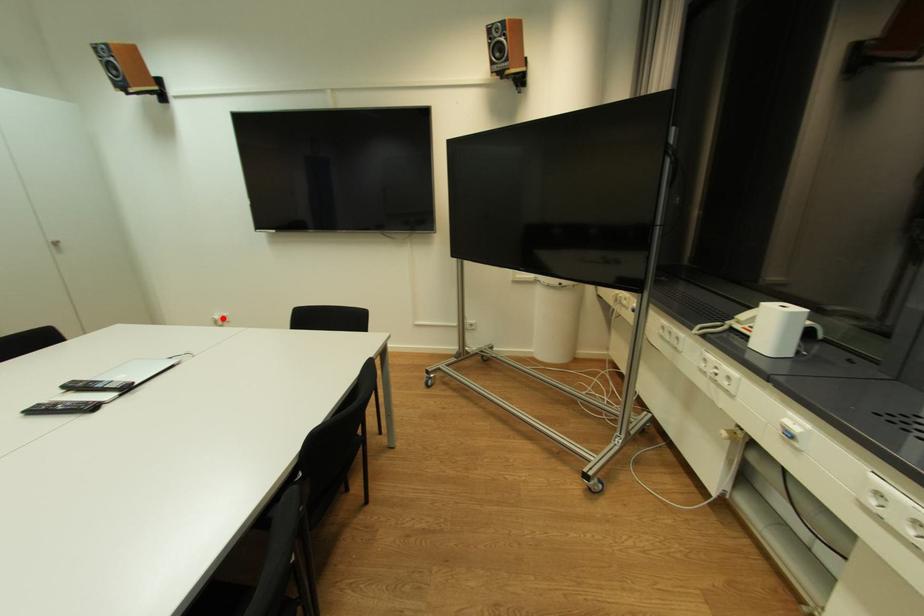
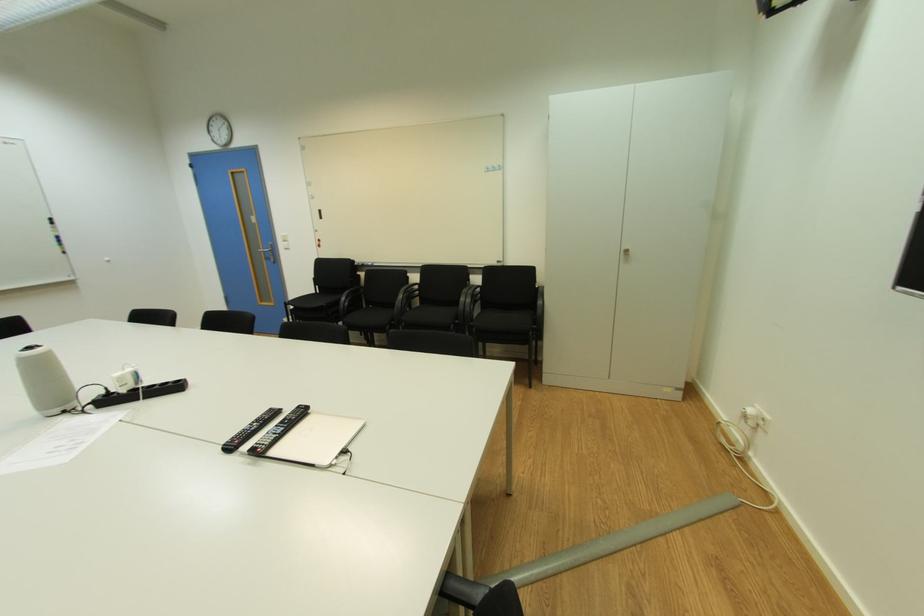
Find the pixel in the second image that matches the highlighted location in the first image.

(757, 411)